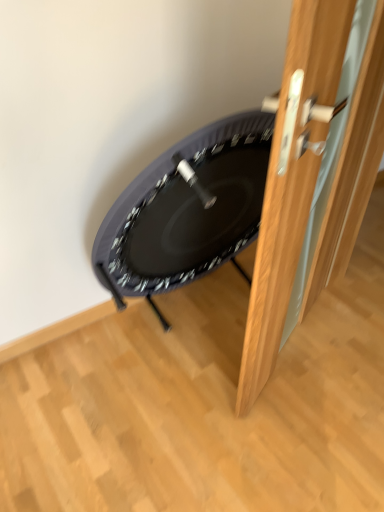
This screenshot has width=384, height=512. I want to click on vacant space situated on the left part of wooden door at right, so click(x=175, y=355).